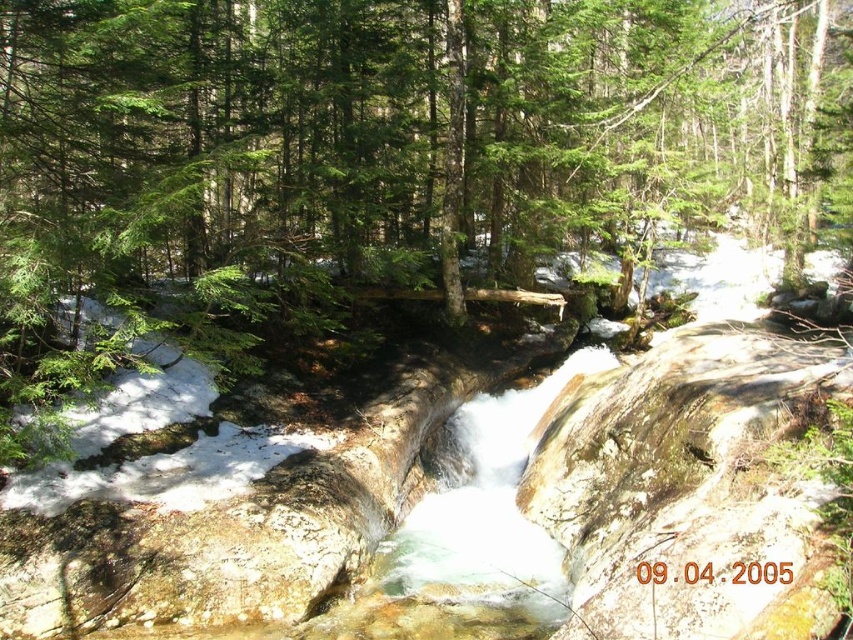
In the scene shown: Who is more distant from viewer, (180,221) or (401,563)?

The point (180,221) is behind.

Who is positioned more to the left, green matte tree at center or clear water at center?

clear water at center is more to the left.

The height and width of the screenshot is (640, 853). I want to click on green matte tree at center, so click(376, 154).

I want to click on green matte tree at center, so click(376, 154).